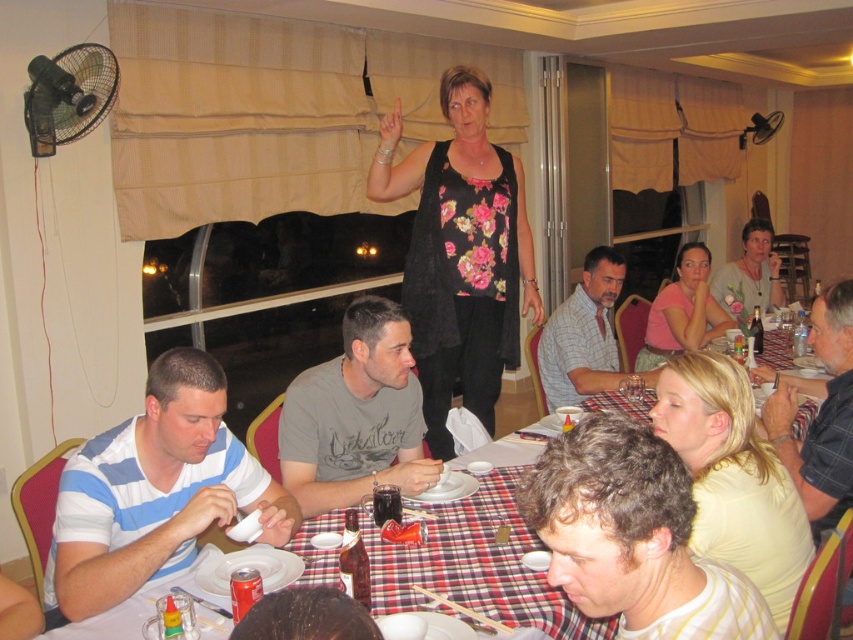
Is plaid shirt at center bigger than pink matte shirt at lower right?

Yes, plaid shirt at center is bigger than pink matte shirt at lower right.

Can you confirm if plaid shirt at center is shorter than pink matte shirt at lower right?

Yes, plaid shirt at center is shorter than pink matte shirt at lower right.

This screenshot has width=853, height=640. I want to click on plaid shirt at center, so click(817, 412).

Is gray cotton shirt at center shorter than pink matte shirt at lower right?

Yes, gray cotton shirt at center is shorter than pink matte shirt at lower right.

The width and height of the screenshot is (853, 640). Find the location of `gray cotton shirt at center`. gray cotton shirt at center is located at coordinates (357, 416).

Locate an element on the screen. Image resolution: width=853 pixels, height=640 pixels. floral print dress at center is located at coordinates (460, 253).

Describe the element at coordinates (460, 253) in the screenshot. Image resolution: width=853 pixels, height=640 pixels. I see `floral print dress at center` at that location.

Between point (437, 161) and point (753, 266), which one is positioned behind?

Point (753, 266)

What are the coordinates of `floral print dress at center` in the screenshot? It's located at (460, 253).